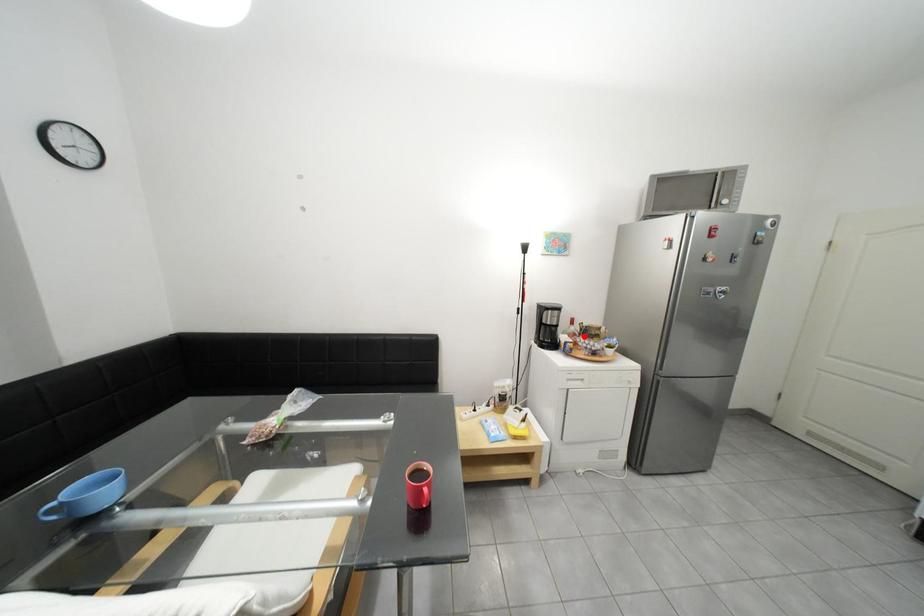
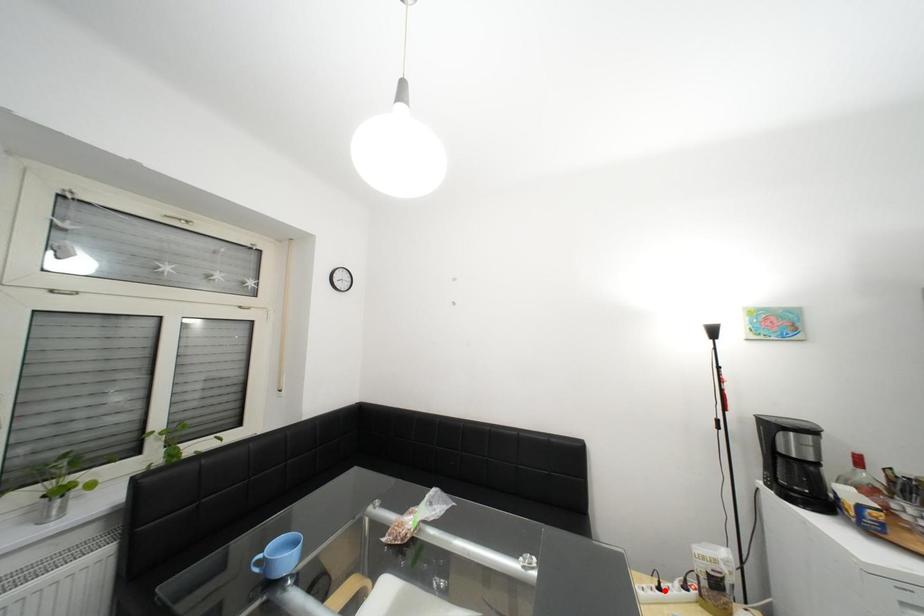
I am providing you with two images of the same scene from different viewpoints. A red point is marked on the first image and another point is marked on the second image. Are the points marked in image1 and image2 representing the same 3D position?

No